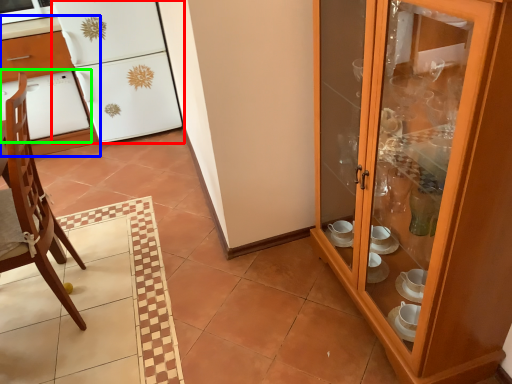
Question: Which is nearer to the refrigerator (highlighted by a red box)? desk (highlighted by a blue box) or oven (highlighted by a green box).

Choices:
 (A) desk
 (B) oven

Answer: (A)